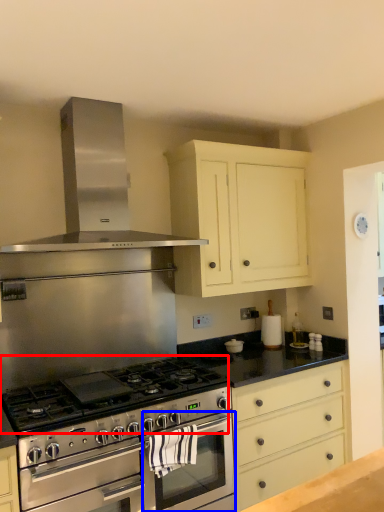
Question: Which object appears closest to the camera in this image, gas stove (highlighted by a red box) or oven (highlighted by a blue box)?

Choices:
 (A) gas stove
 (B) oven

Answer: (A)